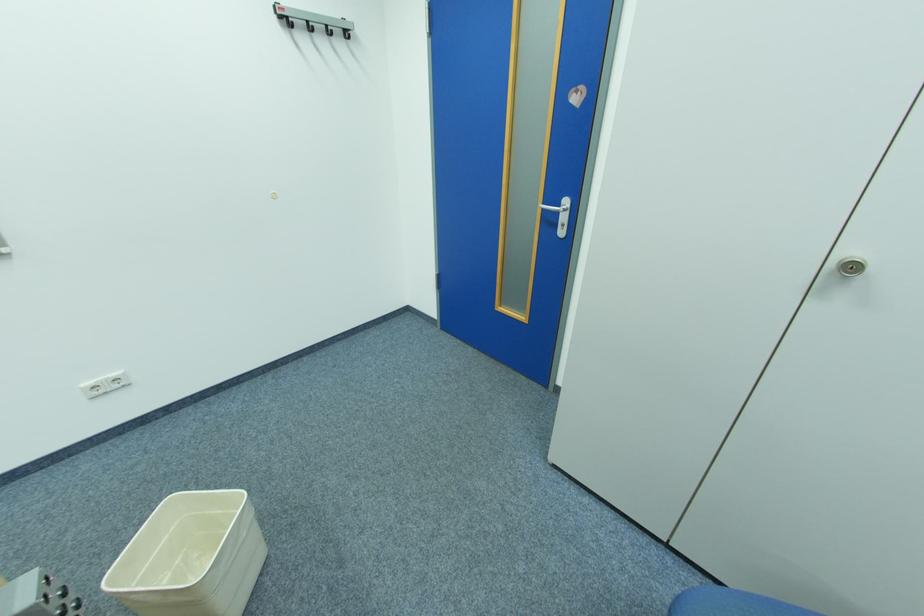
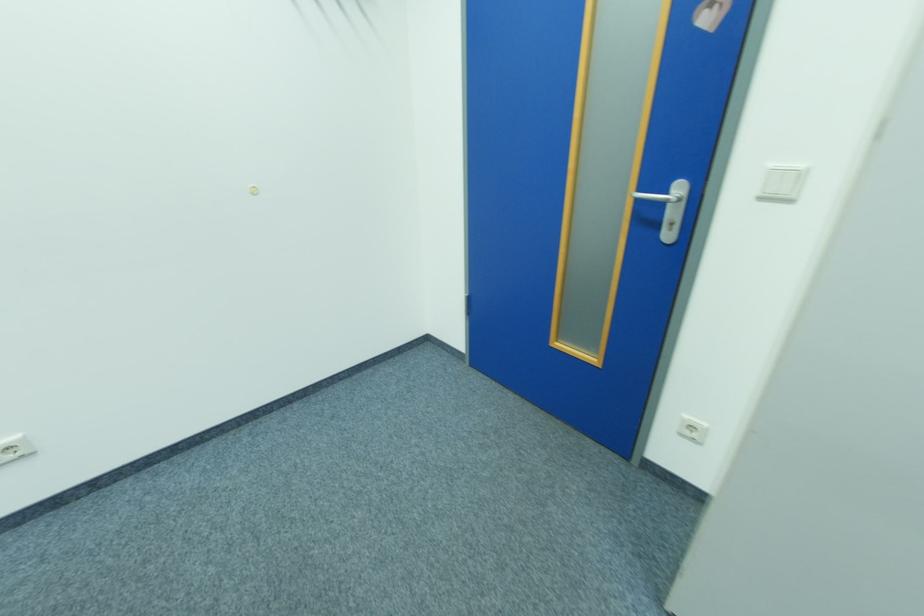
Question: Based on the continuous images, in which direction is the camera rotating? Reply with the corresponding letter.

Choices:
 (A) Left
 (B) Right
 (C) Up
 (D) Down

Answer: (C)